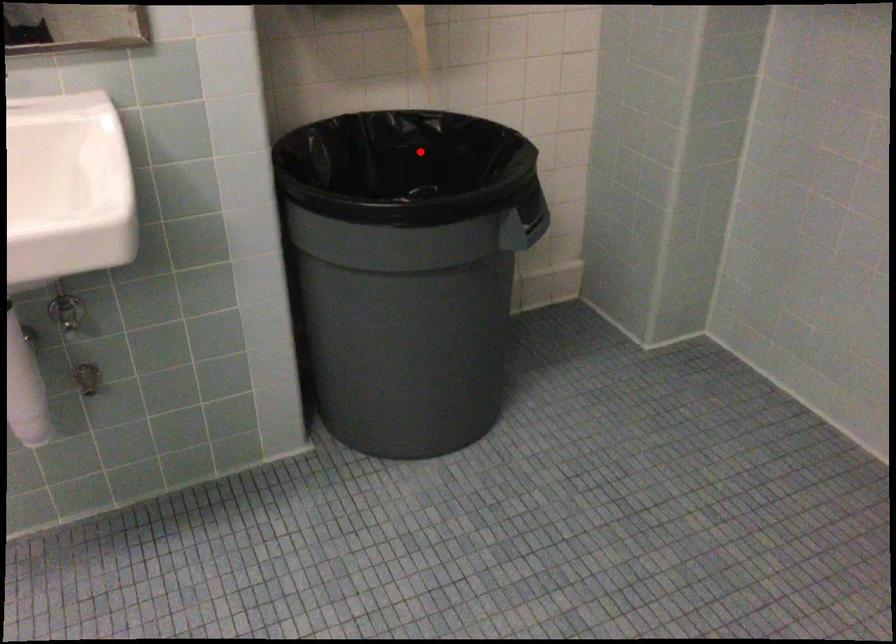
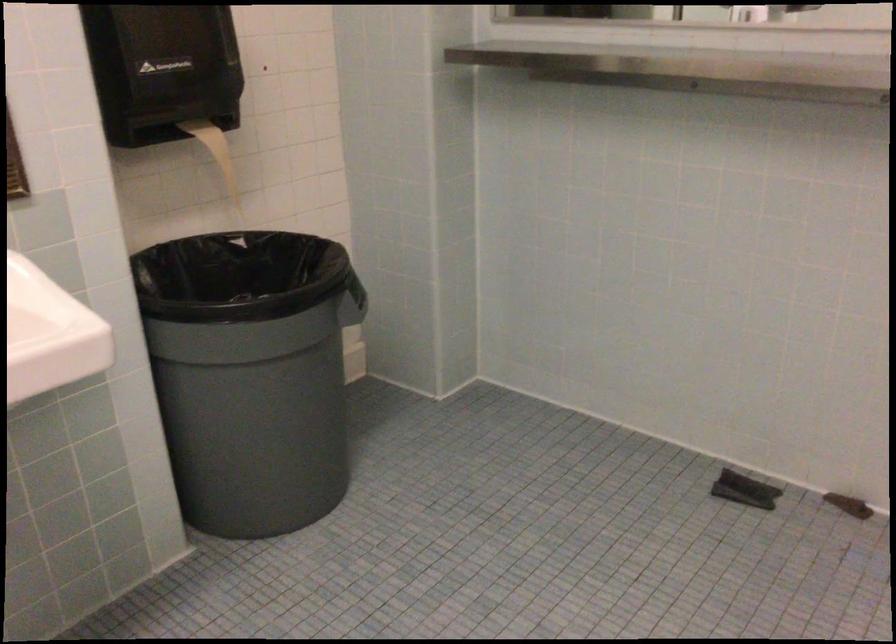
In the second image, find the point that corresponds to the highlighted location in the first image.

(228, 266)